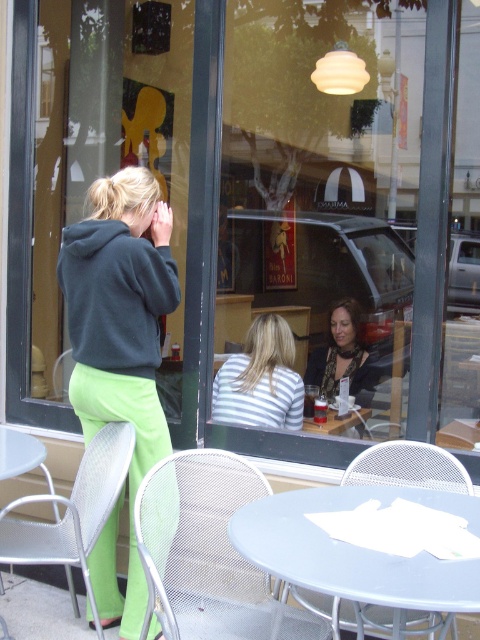
Describe the element at coordinates (129, 477) in the screenshot. I see `green fabric pants at lower left` at that location.

Is green fabric pants at lower left shorter than striped fabric shirt at center?

No.

Does point (100, 369) come behind point (288, 429)?

That is False.

Find the location of a particular element. green fabric pants at lower left is located at coordinates (129, 477).

Is light blue plastic table at center wider than floral-patterned blouse at center?

Correct, the width of light blue plastic table at center exceeds that of floral-patterned blouse at center.

Is point (323, 577) positioned before point (373, 385)?

Yes, it is.

Image resolution: width=480 pixels, height=640 pixels. Find the location of `light blue plastic table at center`. light blue plastic table at center is located at coordinates (356, 548).

Between metal mesh chair at lower center and light blue plastic table at center, which one has more height?

metal mesh chair at lower center

Between point (217, 492) and point (301, 522), which one is positioned in front?

Point (301, 522) is in front.

In order to click on metal mesh chair at lower center in this screenshot , I will do `click(207, 554)`.